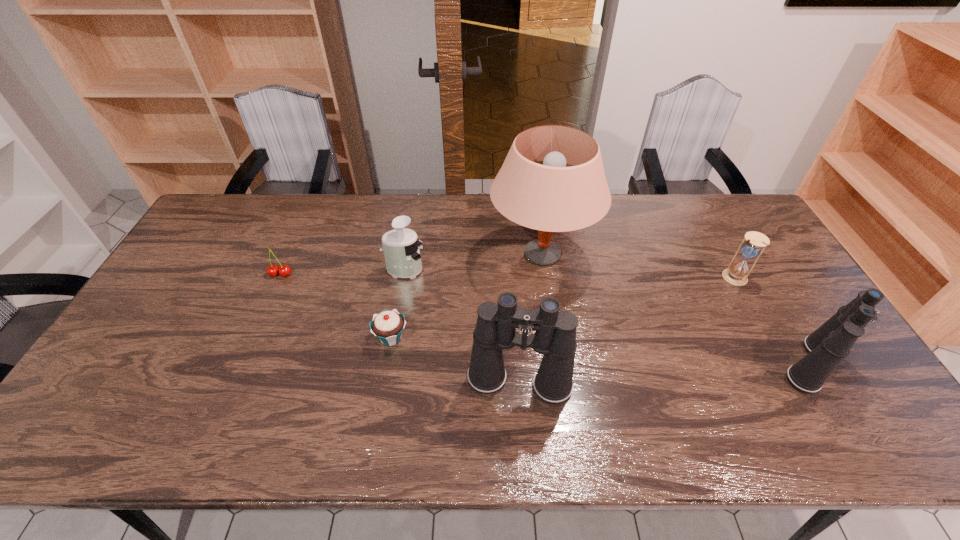
This screenshot has height=540, width=960. I want to click on hourglass that is positioned at the right edge, so click(737, 272).

You are a GUI agent. You are given a task and a screenshot of the screen. Output one action in this format:
    pyautogui.click(x=<x>, y=<y>)
    Task: Click on the object that is positioned at the near right corner
    
    Given the screenshot: What is the action you would take?
    pyautogui.click(x=827, y=346)

Image resolution: width=960 pixels, height=540 pixels. I want to click on blank area at the far edge, so click(x=504, y=236).

In the image, there is a desktop. At what (x,y) coordinates should I click in order to perform the action: click on vacant region at the near edge. Please return your answer as a coordinate pair (x, y). Looking at the image, I should click on pyautogui.click(x=438, y=394).

The height and width of the screenshot is (540, 960). In order to click on free space at the left edge in this screenshot , I will do `click(161, 358)`.

Locate an element on the screen. This screenshot has height=540, width=960. vacant area at the right edge is located at coordinates (789, 281).

You are a GUI agent. You are given a task and a screenshot of the screen. Output one action in this format:
    pyautogui.click(x=<x>, y=<y>)
    Task: Click on the vacant space at the far right corner of the desktop
    This screenshot has width=960, height=540.
    Given the screenshot: What is the action you would take?
    pyautogui.click(x=755, y=226)

Find the location of `free spot between the juicer and the leftmost object`. free spot between the juicer and the leftmost object is located at coordinates (x=343, y=272).

Where is `free space that is in between the cupcake and the leftmost object`? The width and height of the screenshot is (960, 540). free space that is in between the cupcake and the leftmost object is located at coordinates (336, 306).

The image size is (960, 540). Identify the location of vacant area between the juicer and the leftmost object. (343, 272).